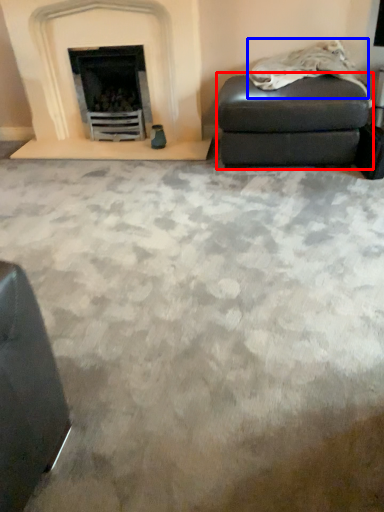
Question: Which point is closer to the camera, stool (highlighted by a red box) or material (highlighted by a blue box)?

Choices:
 (A) stool
 (B) material

Answer: (B)